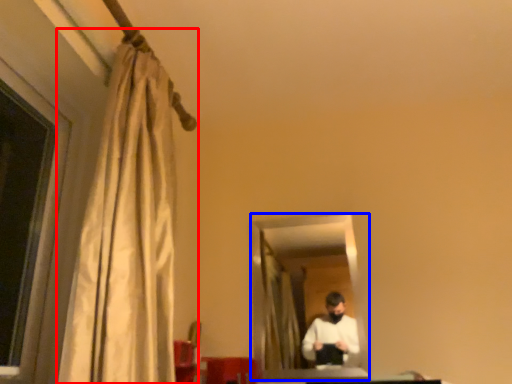
Question: Which point is closer to the camera, curtain (highlighted by a red box) or mirror (highlighted by a blue box)?

Choices:
 (A) curtain
 (B) mirror

Answer: (A)